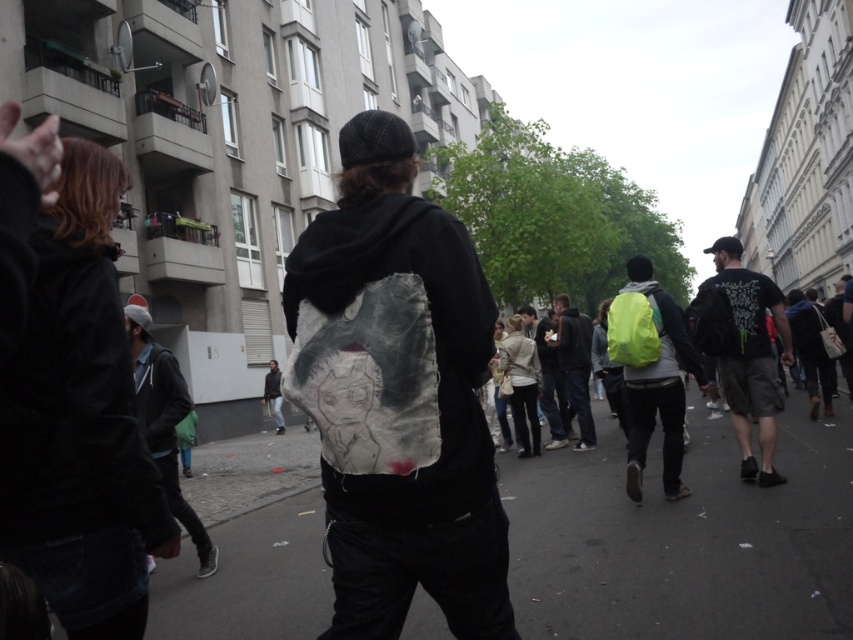
Question: Which point is farther from the camera taking this photo?

Choices:
 (A) (618, 355)
 (B) (744, 289)

Answer: (B)

Question: From the image, what is the correct spatial relationship of dark green t-shirt at right in relation to dark gray fabric backpack at center?

Choices:
 (A) right
 (B) left

Answer: (A)

Question: From the image, what is the correct spatial relationship of rough canvas bag at center in relation to dark green t-shirt at right?

Choices:
 (A) left
 (B) right

Answer: (A)

Question: Among these points, which one is farthest from the camera?

Choices:
 (A) (347, 541)
 (B) (560, 353)
 (C) (770, 468)
 (D) (138, 388)

Answer: (B)

Question: Can you confirm if rough canvas bag at center is positioned above dark gray hoodie at left?

Choices:
 (A) no
 (B) yes

Answer: (B)

Question: Which point appears closest to the camera in this image?

Choices:
 (A) (349, 564)
 (B) (183, 401)
 (C) (647, 269)
 (D) (589, 449)

Answer: (A)